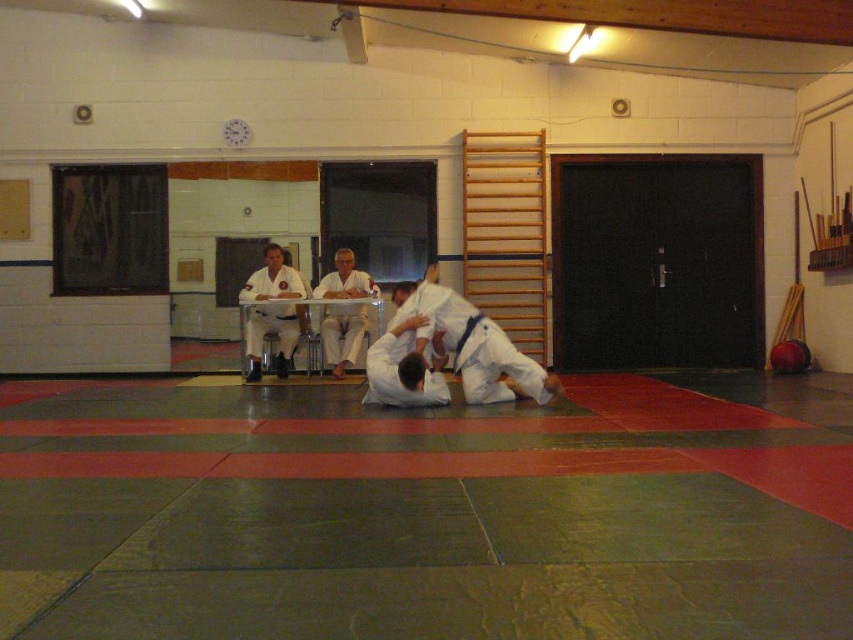
Question: Does white karate gi at center appear on the right side of white karate uniform at center?

Choices:
 (A) yes
 (B) no

Answer: (A)

Question: Is white karate gi at center wider than white karate uniform at center?

Choices:
 (A) yes
 (B) no

Answer: (A)

Question: Based on their relative distances, which object is nearer to the white fabric pants at center?

Choices:
 (A) white karate gi at center
 (B) white karate uniform at center

Answer: (B)

Question: Among these objects, which one is farthest from the camera?

Choices:
 (A) white fabric pants at center
 (B) white karate gi at center
 (C) white karate uniform at center

Answer: (A)

Question: Does white karate gi at center appear on the left side of white fabric pants at center?

Choices:
 (A) no
 (B) yes

Answer: (A)

Question: Which point is farther to the camera?

Choices:
 (A) white fabric pants at center
 (B) white karate uniform at center
 (C) white karate gi at center

Answer: (A)